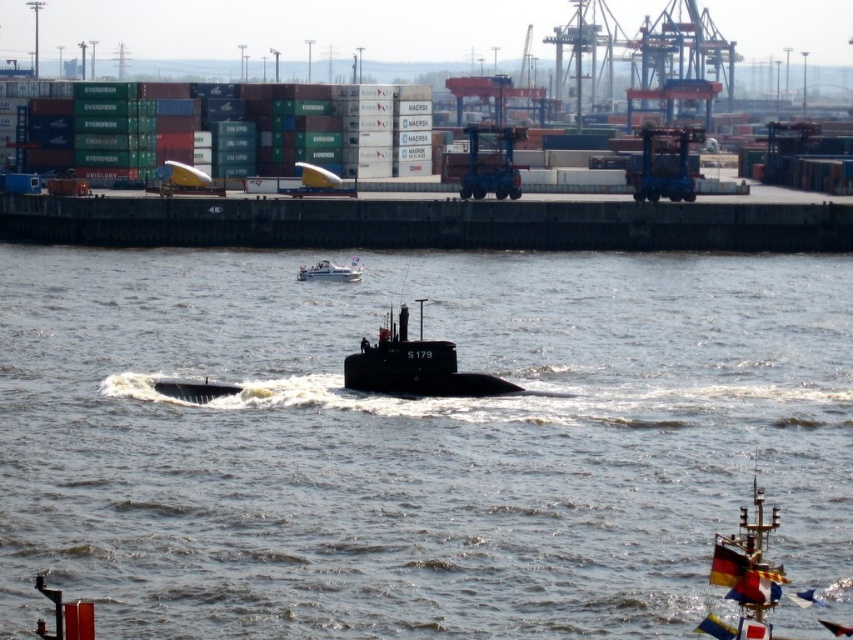
Question: Among these objects, which one is farthest from the camera?

Choices:
 (A) transparent water at center
 (B) black matte submarine at center
 (C) white glossy boat at upper center
 (D) green matte containers at upper left

Answer: (D)

Question: Does transparent water at center appear over black matte submarine at center?

Choices:
 (A) no
 (B) yes

Answer: (B)

Question: Can you confirm if green matte containers at upper left is wider than white glossy boat at upper center?

Choices:
 (A) yes
 (B) no

Answer: (A)

Question: Which point is farther to the camera?

Choices:
 (A) green matte containers at upper left
 (B) transparent water at center
 (C) white glossy boat at upper center
 (D) black matte submarine at center

Answer: (A)

Question: Estimate the real-world distances between objects in this image. Which object is closer to the transparent water at center?

Choices:
 (A) green matte containers at upper left
 (B) black matte submarine at center
 (C) white glossy boat at upper center

Answer: (B)

Question: Does green matte containers at upper left appear on the left side of white glossy boat at upper center?

Choices:
 (A) yes
 (B) no

Answer: (A)